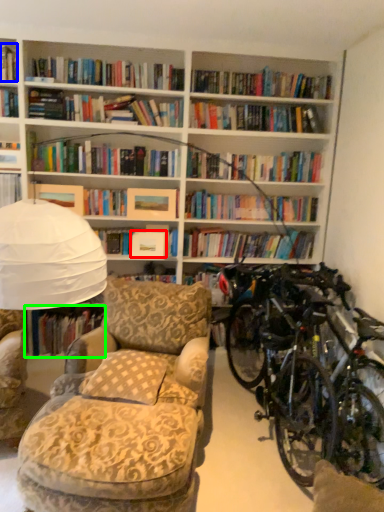
Question: Which object is positioned closest to paperback book (highlighted by a red box)? Select from book (highlighted by a blue box) and book (highlighted by a green box).

Choices:
 (A) book
 (B) book

Answer: (B)